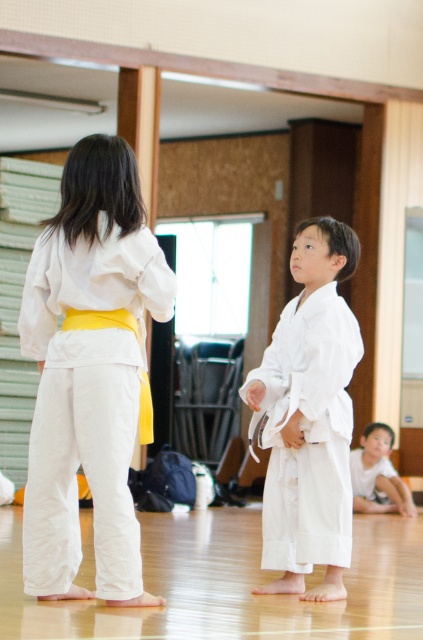
You are a photographer setting up for a karate class photo. You need to position a camera tripod between the white cotton karate gi at center and the smooth white karate gi at lower right. Based on their positions, which side of the path between them should you place the tripod to ensure it is centered?

The white cotton karate gi at center is to the left of the smooth white karate gi at lower right, so placing the tripod in the middle of the path between them would center it between the two gis.

You are a photographer setting up for a martial arts class photo. You need to ensure both the white cotton karate gi at center and the white cotton kimono at center are clearly visible. Since you can only adjust your focus on one object, which one should you focus on to capture both in sharp detail?

The white cotton karate gi at center is closer to the viewer than the white cotton kimono at center. By focusing on the closer object, the karate gi, the depth of field may allow both to be in focus, especially if using a small aperture or a wide angle lens.

From the picture: You are a photographer standing in the dojo and want to take a photo of the two points marked in the scene. Which point, point (x=139, y=538) or point (x=346, y=445), is closer to you?

Point (x=139, y=538) is closer to the viewer than point (x=346, y=445).